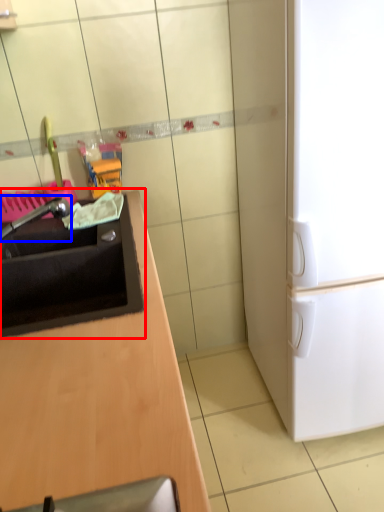
Question: Among these objects, which one is nearest to the camera, sink (highlighted by a red box) or faucet (highlighted by a blue box)?

Choices:
 (A) sink
 (B) faucet

Answer: (A)